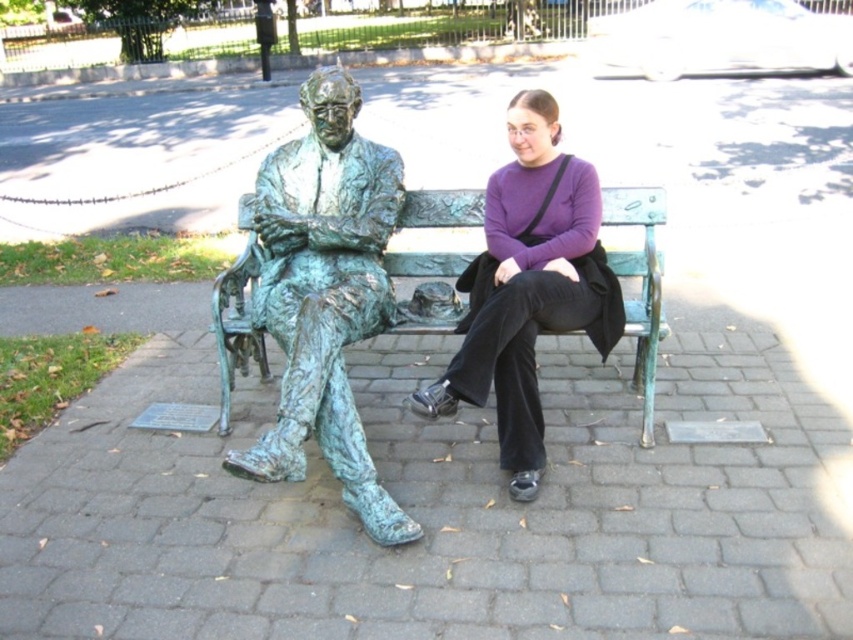
Can you confirm if purple matte sweater at center is bigger than green patina bench at center?

Yes, purple matte sweater at center is bigger than green patina bench at center.

Does purple matte sweater at center have a smaller size compared to green patina bench at center?

Actually, purple matte sweater at center might be larger than green patina bench at center.

Does point (525, 192) come closer to viewer compared to point (418, 253)?

Yes.

Locate an element on the screen. purple matte sweater at center is located at coordinates (527, 285).

Does green patina bronze statue at center have a greater width compared to purple matte sweater at center?

In fact, green patina bronze statue at center might be narrower than purple matte sweater at center.

Identify the location of green patina bronze statue at center. (325, 292).

Who is positioned more to the left, green patina bronze statue at center or green patina bench at center?

green patina bronze statue at center is more to the left.

Which of these two, green patina bronze statue at center or green patina bench at center, stands shorter?

With less height is green patina bench at center.

Where is `green patina bronze statue at center`? This screenshot has width=853, height=640. green patina bronze statue at center is located at coordinates (325, 292).

In order to click on green patina bronze statue at center in this screenshot , I will do `click(325, 292)`.